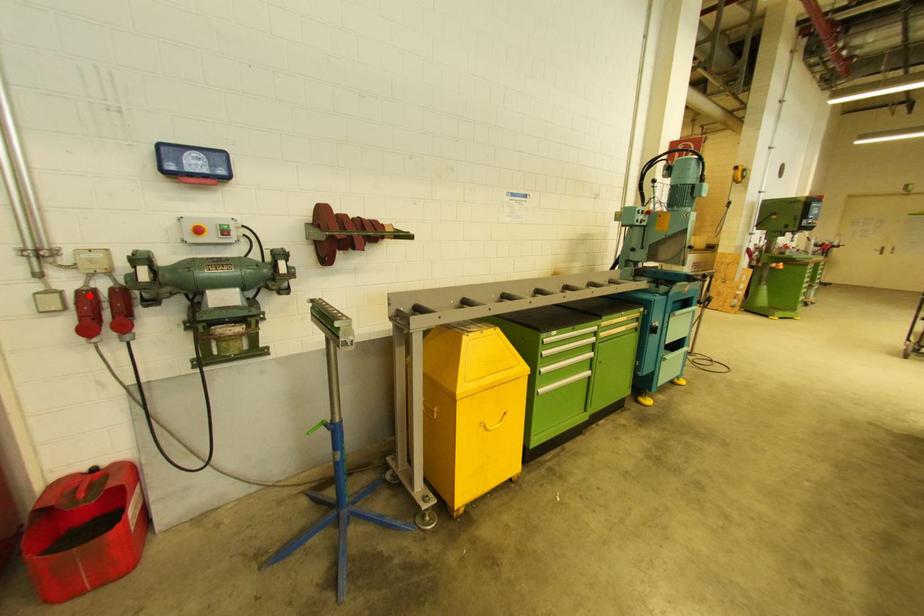
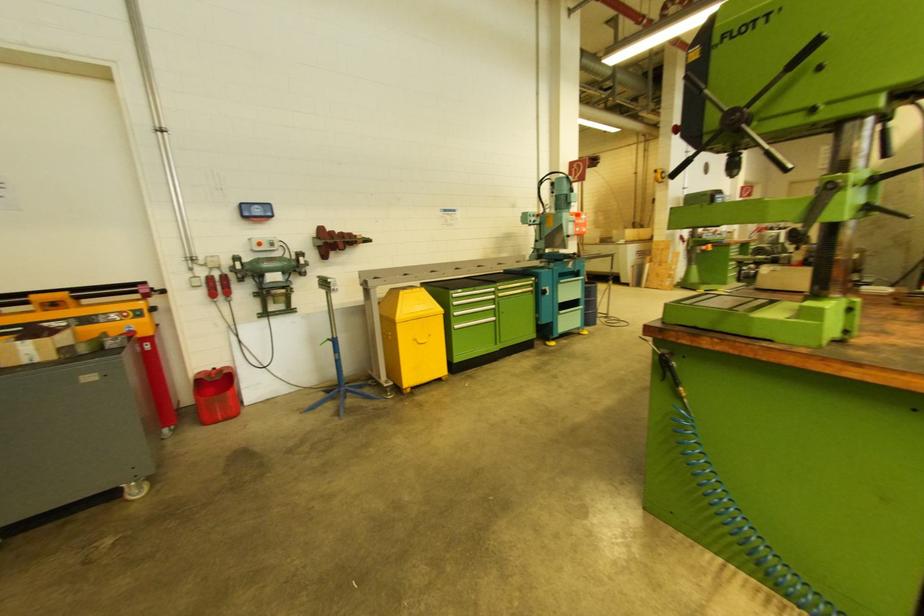
Where in the second image is the point corresponding to the highlighted location from the first image?

(212, 281)